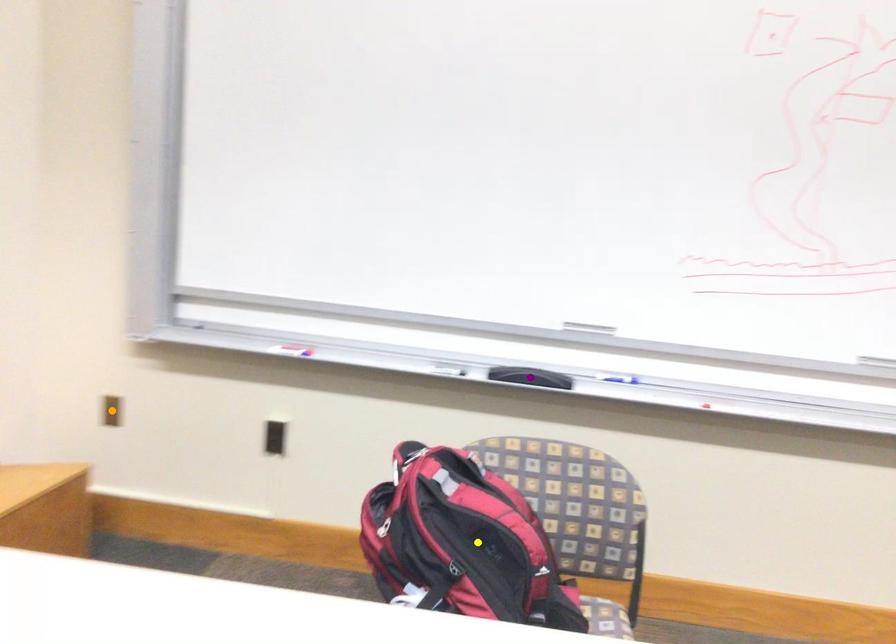
Order these from nearest to farthest:
1. yellow point
2. orange point
3. purple point

yellow point → purple point → orange point